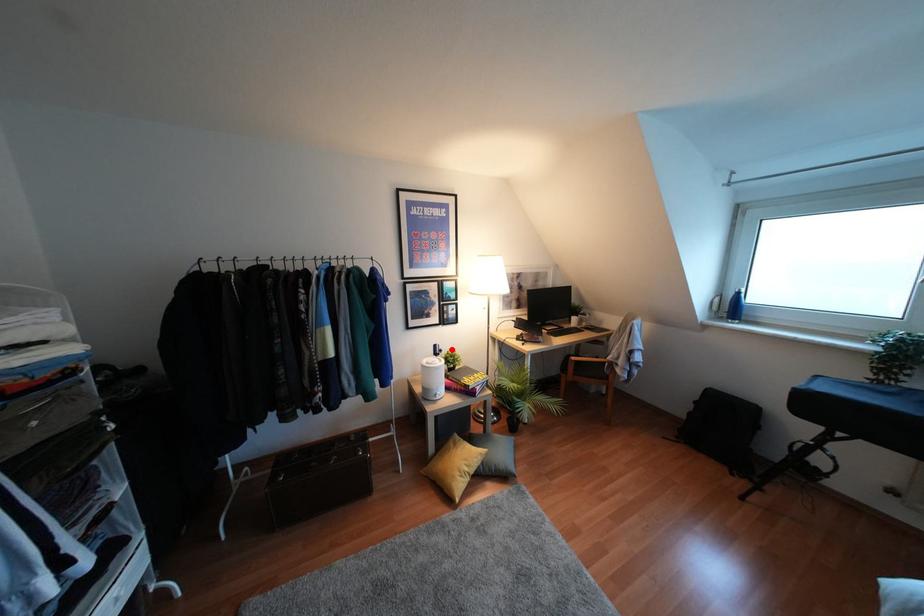
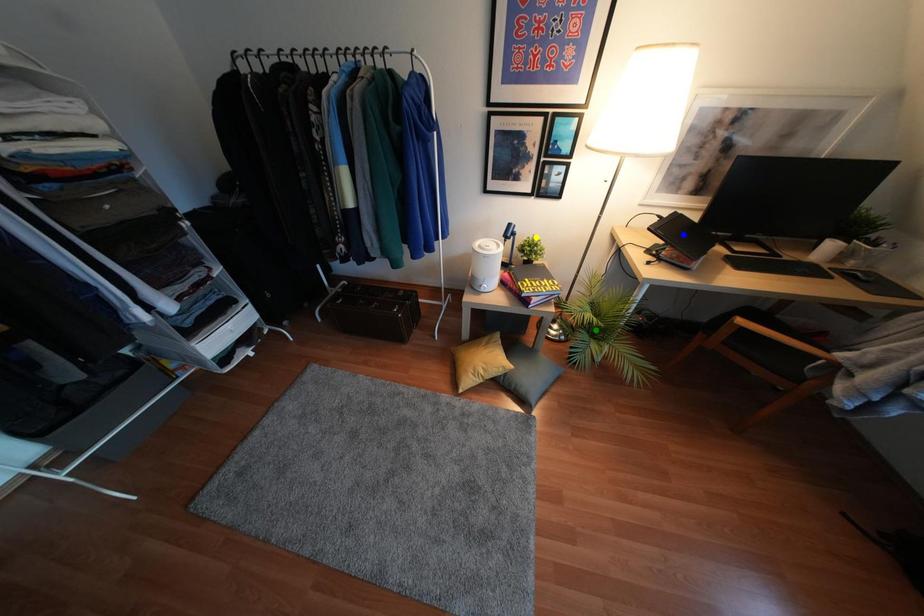
Question: I am providing you with two images of the same scene from different viewpoints. A red point is marked on the first image. You are given multiple points on the second image. Which mark in image 2 goes with the point in image 1?

Choices:
 (A) yellow point
 (B) green point
 (C) blue point

Answer: (A)